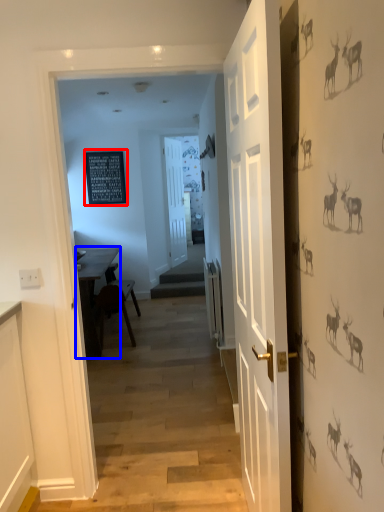
Question: Among these objects, which one is farthest to the camera, bulletin board (highlighted by a red box) or table (highlighted by a blue box)?

Choices:
 (A) bulletin board
 (B) table

Answer: (A)